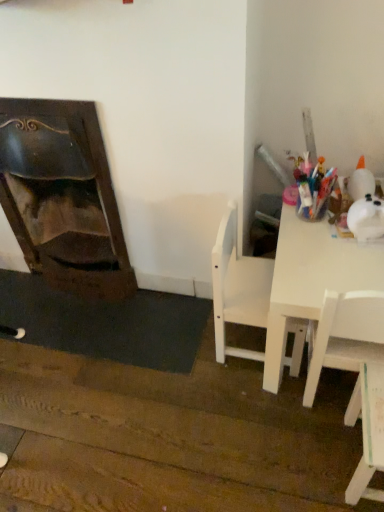
Where is `vacant position to the left of white matte chair at center, placed as the first chair when sorted from left to right`? The image size is (384, 512). vacant position to the left of white matte chair at center, placed as the first chair when sorted from left to right is located at coordinates (181, 343).